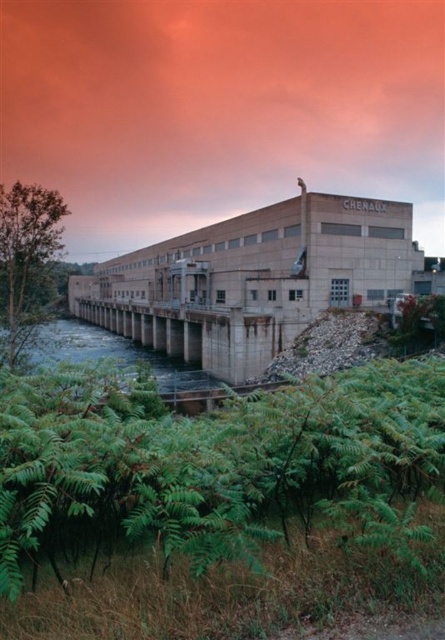
Question: Can you confirm if green leafy shrubs at lower left is thinner than clear concrete dam at center?

Choices:
 (A) no
 (B) yes

Answer: (B)

Question: Does green leafy shrubs at lower left appear under clear concrete dam at center?

Choices:
 (A) no
 (B) yes

Answer: (A)

Question: Is green leafy shrubs at lower left bigger than clear concrete dam at center?

Choices:
 (A) yes
 (B) no

Answer: (B)

Question: Which of the following is the closest to the observer?

Choices:
 (A) click(x=126, y=356)
 (B) click(x=368, y=380)

Answer: (B)